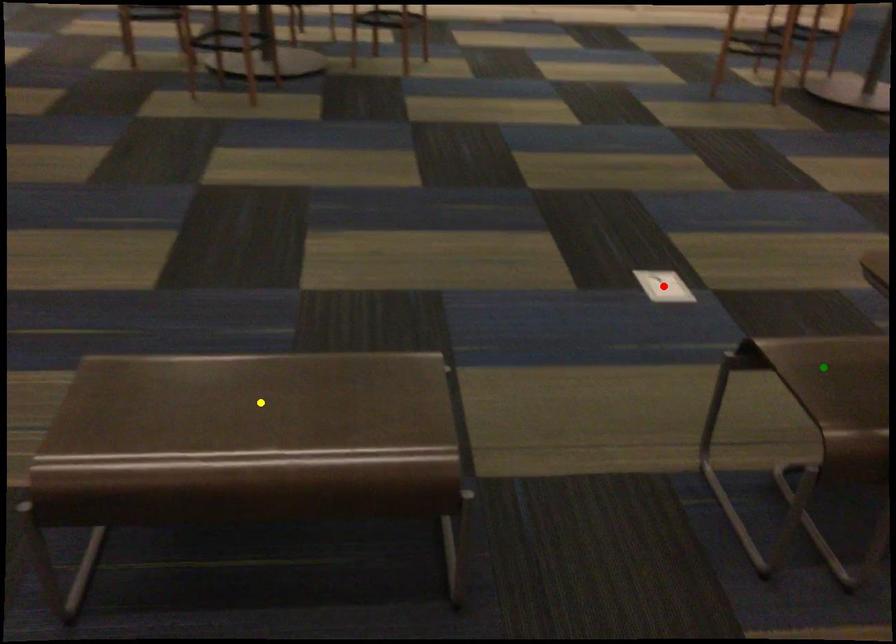
Order these from nearest to farthest:
yellow point
red point
green point

yellow point < green point < red point